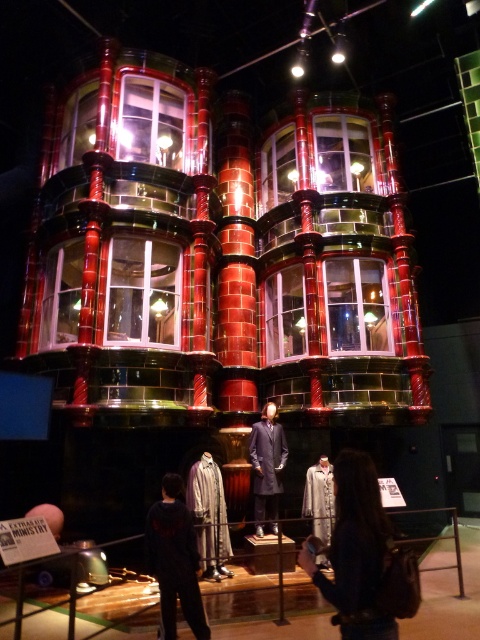
Question: Is the position of dark gray fabric jacket at lower center more distant than that of silvery metallic robe at center?

Choices:
 (A) yes
 (B) no

Answer: (B)

Question: Which of the following is the farthest from the observer?

Choices:
 (A) smooth gray robe at center
 (B) matte black suit at center

Answer: (B)

Question: Can you confirm if dark gray fabric jacket at lower center is bigger than silky white robe at center?

Choices:
 (A) yes
 (B) no

Answer: (B)

Question: Which of the following is the closest to the observer?

Choices:
 (A) (149, 570)
 (B) (324, 476)
 (C) (216, 515)
 (D) (336, 588)

Answer: (D)

Question: Is matte black suit at center further to the viewer compared to silvery metallic robe at center?

Choices:
 (A) no
 (B) yes

Answer: (B)

Question: Which point appears farthest from the camera in this image?

Choices:
 (A) (342, 506)
 (B) (199, 621)
 (C) (305, 508)
 (D) (253, 456)

Answer: (D)